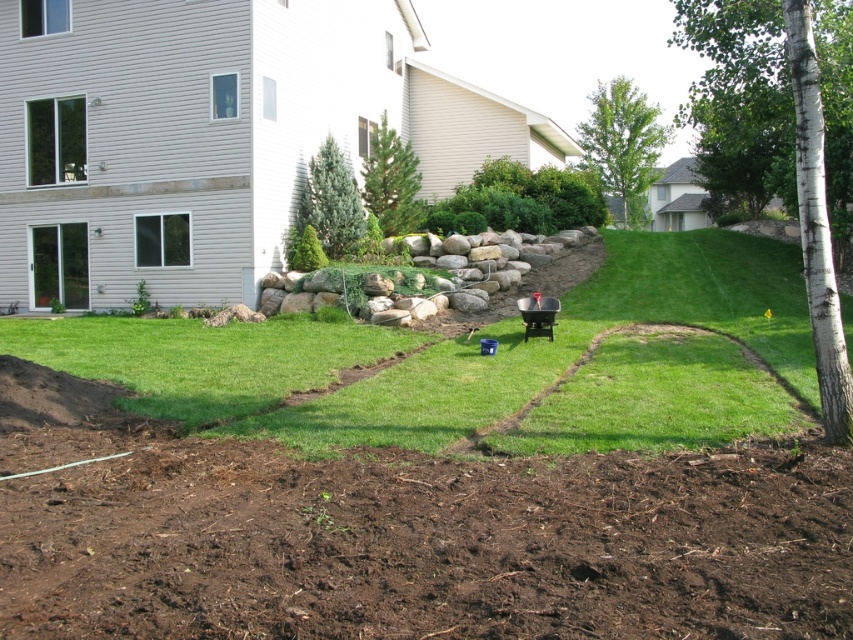
You are standing in the backyard and want to take a photo of both the white smooth tree at right and the green leafy tree at upper center. Which tree should you position closer to the camera to ensure both are in focus?

You should position the white smooth tree at right closer to the camera because it is in front of the green leafy tree at upper center, so keeping it closer ensures both are in focus.

You are planning to plant a new tree in the backyard. The white smooth tree at right and the green leafy tree at upper center are already present. Which existing tree should you consider for spacing requirements due to its size?

The white smooth tree at right is larger in size than the green leafy tree at upper center, so you should consider its spacing requirements more carefully when planting the new tree.